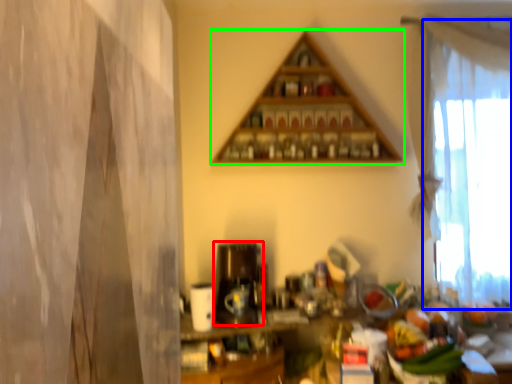
Question: Considering the real-world distances, which object is farthest from appliance (highlighted by a red box)? curtain (highlighted by a blue box) or shelf (highlighted by a green box)?

Choices:
 (A) curtain
 (B) shelf

Answer: (A)